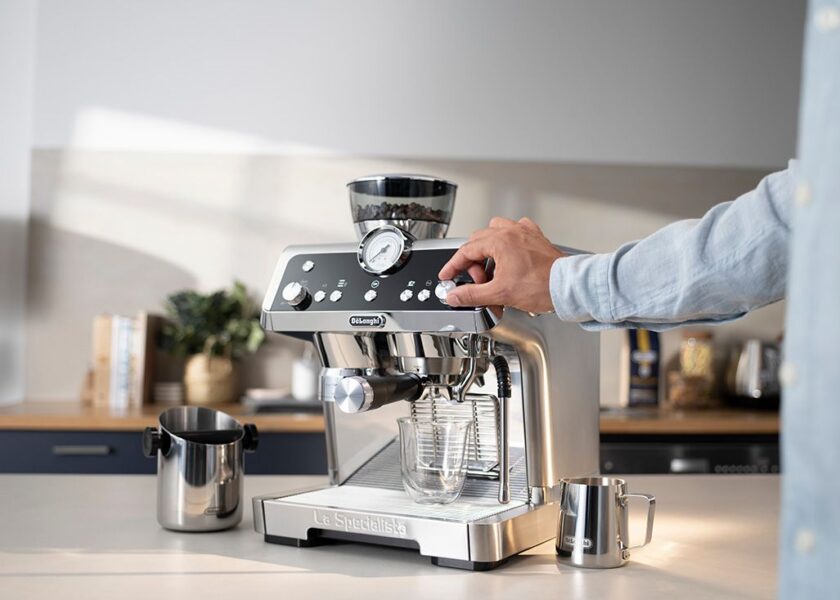
Identify the location of cup handle. (649, 519).